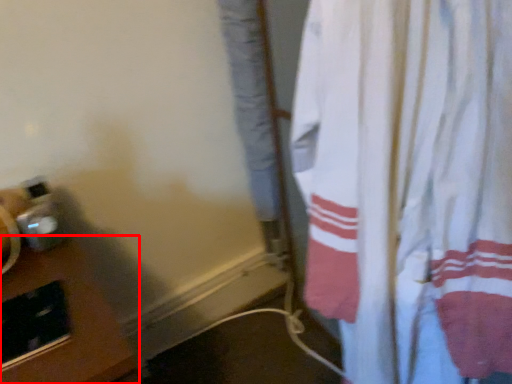
Question: Considering the relative positions of table (annotated by the red box) and curtain in the image provided, where is table (annotated by the red box) located with respect to the staircase?

Choices:
 (A) right
 (B) left

Answer: (B)